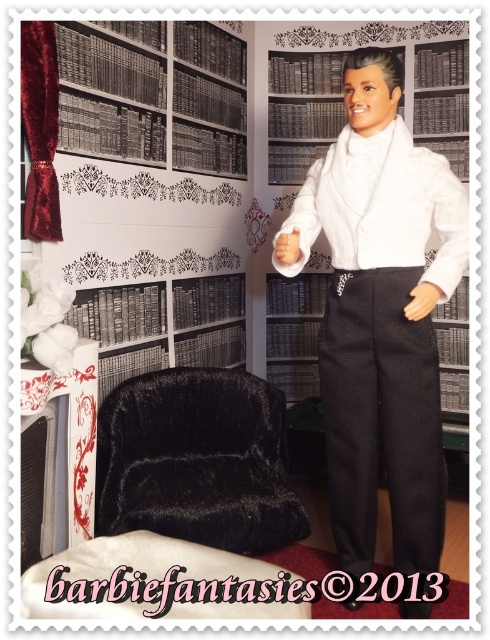
Question: Does white satin tuxedo at center come in front of velvet black armchair at lower left?

Choices:
 (A) no
 (B) yes

Answer: (B)

Question: Is white satin tuxedo at center positioned before velvet black armchair at lower left?

Choices:
 (A) no
 (B) yes

Answer: (B)

Question: Is white satin tuxedo at center further to camera compared to velvet black armchair at lower left?

Choices:
 (A) no
 (B) yes

Answer: (A)